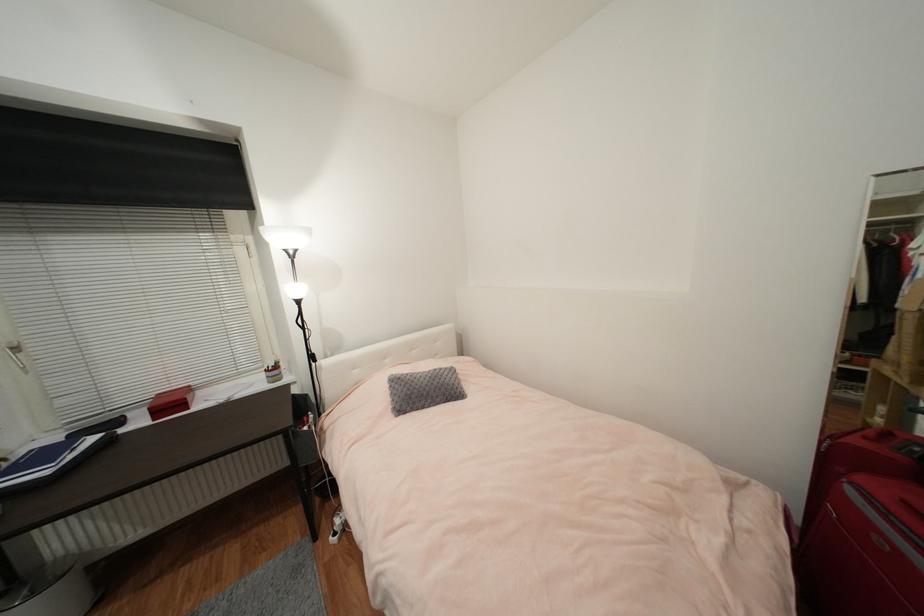
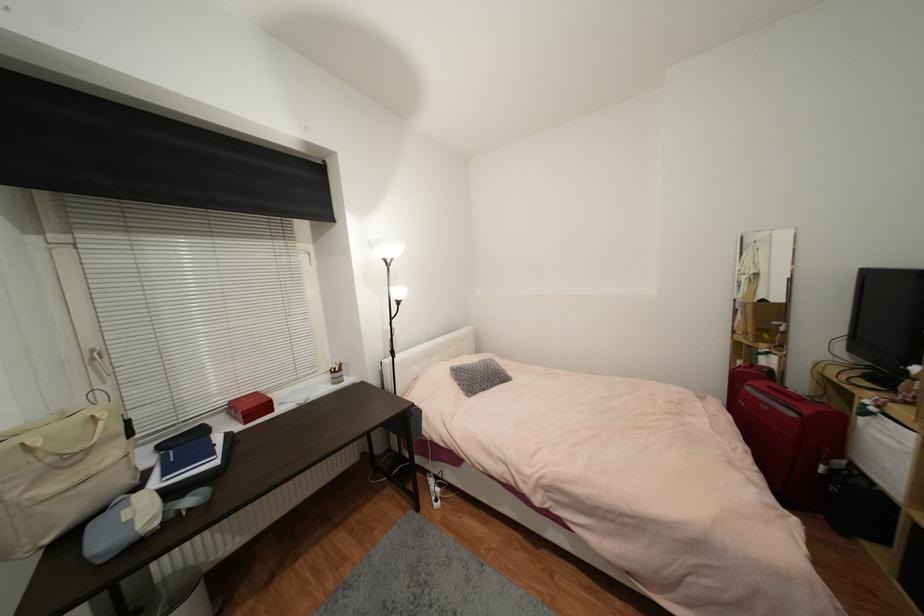
Question: The camera is either moving clockwise (left) or counter-clockwise (right) around the object. The first image is from the beginning of the video and the second image is from the end. Is the camera moving left or right when shooting the video?

Choices:
 (A) Left
 (B) Right

Answer: (A)